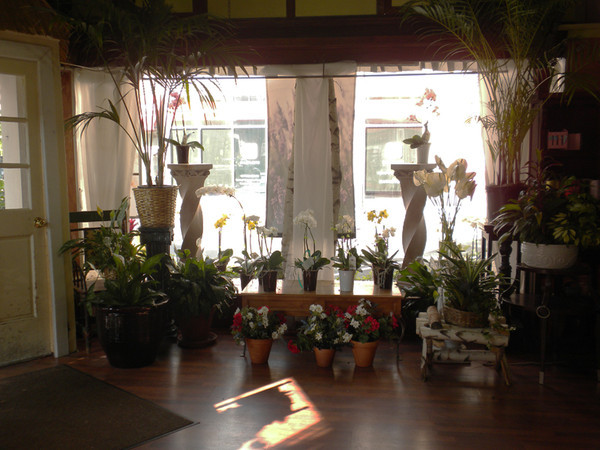
The height and width of the screenshot is (450, 600). Find the location of `chair`. chair is located at coordinates (91, 278).